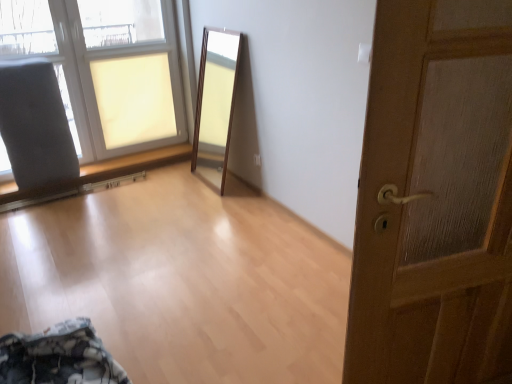
Find the location of a particular element. The width and height of the screenshot is (512, 384). wooden door at right is located at coordinates (435, 198).

I want to click on wooden door at right, so click(x=435, y=198).

Is wooden door at right oriented away from gray fabric armchair at left?

No, gray fabric armchair at left is not at the back of wooden door at right.

From the image's perspective, is wooden door at right on gray fabric armchair at left?

No, from the image's perspective, wooden door at right is not over gray fabric armchair at left.

From a real-world perspective, which is physically below, wooden door at right or gray fabric armchair at left?

gray fabric armchair at left is physically lower.

Which is closer to the camera, (459, 370) or (10, 82)?

Positioned in front is point (459, 370).

Is matte glass window at upper left situated inside gray fabric armchair at left or outside?

matte glass window at upper left is not enclosed by gray fabric armchair at left.

Which object is further away from the camera, matte glass window at upper left or gray fabric armchair at left?

Positioned behind is gray fabric armchair at left.

In the scene shown: Which is less distant, (140, 131) or (349, 353)?

Point (140, 131) is farther from the camera than point (349, 353).

In terms of height, does matte glass window at upper left look taller or shorter compared to wooden door at right?

In the image, matte glass window at upper left appears to be shorter than wooden door at right.

Looking at this image, from the image's perspective, is matte glass window at upper left located above wooden door at right?

Yes, from the image's perspective, matte glass window at upper left is over wooden door at right.

Considering the sizes of objects wooden door at right and matte glass window at upper left in the image provided, who is bigger, wooden door at right or matte glass window at upper left?

With larger size is matte glass window at upper left.

Is wooden door at right far away from matte glass window at upper left?

wooden door at right is positioned a significant distance from matte glass window at upper left.

From the image's perspective, is wooden door at right over matte glass window at upper left?

No, from the image's perspective, wooden door at right is not over matte glass window at upper left.

Considering the sizes of gray fabric armchair at left and matte glass window at upper left in the image, is gray fabric armchair at left wider or thinner than matte glass window at upper left?

Considering their sizes, gray fabric armchair at left looks broader than matte glass window at upper left.

Who is more distant, gray fabric armchair at left or matte glass window at upper left?

Positioned behind is gray fabric armchair at left.

Is gray fabric armchair at left to the left of matte glass window at upper left from the viewer's perspective?

Yes, gray fabric armchair at left is to the left of matte glass window at upper left.

Between gray fabric armchair at left and matte glass window at upper left, which one has less height?

Standing shorter between the two is gray fabric armchair at left.

Is gray fabric armchair at left shorter than wooden door at right?

Indeed, gray fabric armchair at left has a lesser height compared to wooden door at right.

Considering the sizes of objects gray fabric armchair at left and wooden door at right in the image provided, who is smaller, gray fabric armchair at left or wooden door at right?

gray fabric armchair at left.

This screenshot has height=384, width=512. There is a gray fabric armchair at left. In order to click on door above it (from a real-world perspective) in this screenshot , I will do `click(435, 198)`.

From a real-world perspective, is gray fabric armchair at left under wooden door at right?

Yes, from a real-world perspective, gray fabric armchair at left is beneath wooden door at right.

Where is `armchair behind the wooden door at right`? This screenshot has width=512, height=384. armchair behind the wooden door at right is located at coordinates (35, 133).

Identify the location of armchair lying below the matte glass window at upper left (from the image's perspective). (35, 133).

Looking at the image, which one is located closer to wooden door at right, matte glass window at upper left or gray fabric armchair at left?

gray fabric armchair at left is positioned closer to the anchor wooden door at right.

In the scene shown: Considering their positions, is wooden door at right positioned closer to gray fabric armchair at left than matte glass window at upper left?

matte glass window at upper left is positioned closer to the anchor gray fabric armchair at left.

From the image, which object appears to be farther from matte glass window at upper left, wooden door at right or gray fabric armchair at left?

wooden door at right lies further to matte glass window at upper left than the other object.

Looking at the image, which one is located closer to wooden door at right, gray fabric armchair at left or matte glass window at upper left?

Among the two, gray fabric armchair at left is located nearer to wooden door at right.

Looking at this image, when comparing their distances from matte glass window at upper left, does gray fabric armchair at left or wooden door at right seem closer?

gray fabric armchair at left is positioned closer to the anchor matte glass window at upper left.

Estimate the real-world distances between objects in this image. Which object is further from gray fabric armchair at left, matte glass window at upper left or wooden door at right?

wooden door at right is positioned further to the anchor gray fabric armchair at left.

Identify the location of window between gray fabric armchair at left and wooden door at right from left to right. (105, 68).